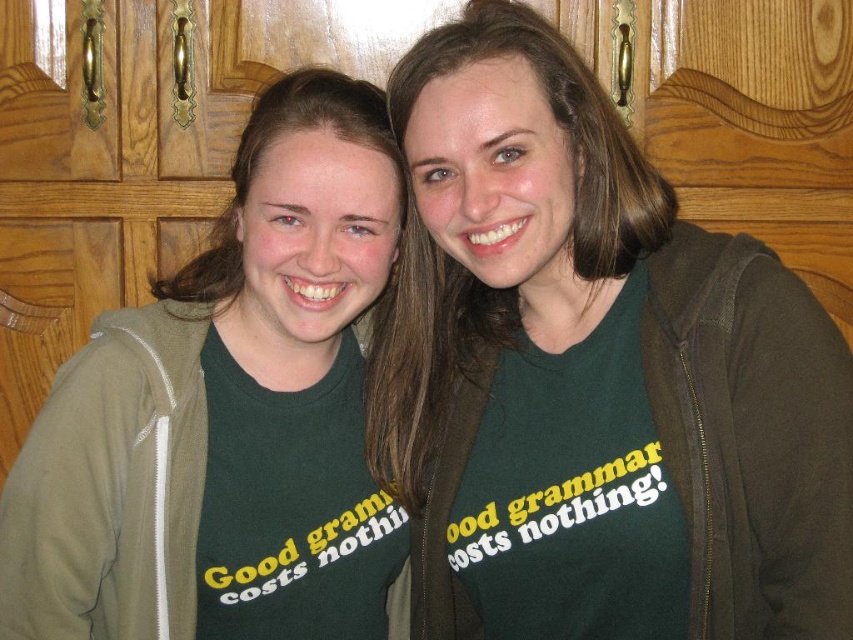
You are standing in a kitchen and see two points marked on the wall. The first point is at coordinate point [9,472] and the second is at point [723,566]. If you want to place a shelf between them, which point should you place the shelf closer to so that it is closer to the back wall?

Since point [9,472] is behind point [723,566], you should place the shelf closer to point [9,472] to be nearer to the back wall.